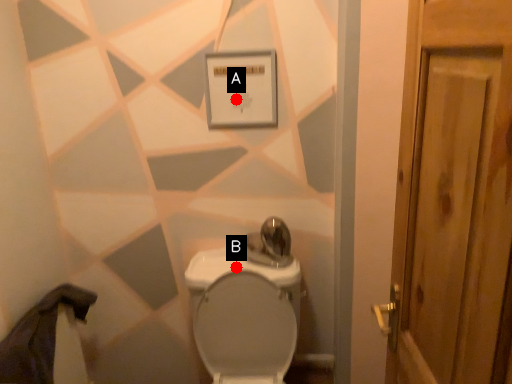
Question: Two points are circled on the image, labeled by A and B beside each circle. Which point is closer to the camera taking this photo?

Choices:
 (A) A is closer
 (B) B is closer

Answer: (A)